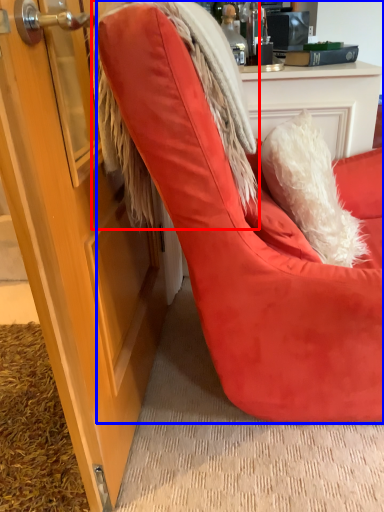
Question: Which object is further to the camera taking this photo, fur coat (highlighted by a red box) or chair (highlighted by a blue box)?

Choices:
 (A) fur coat
 (B) chair

Answer: (A)